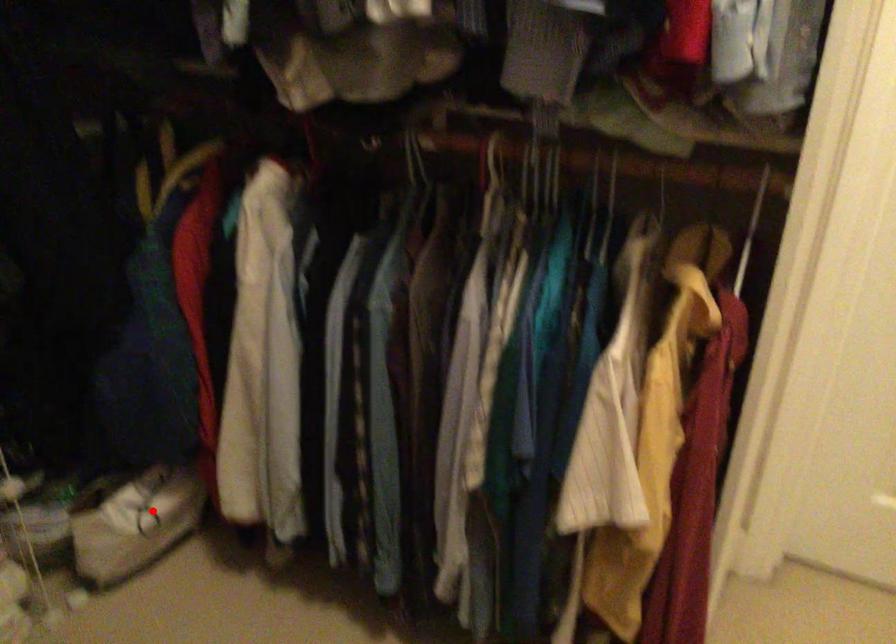
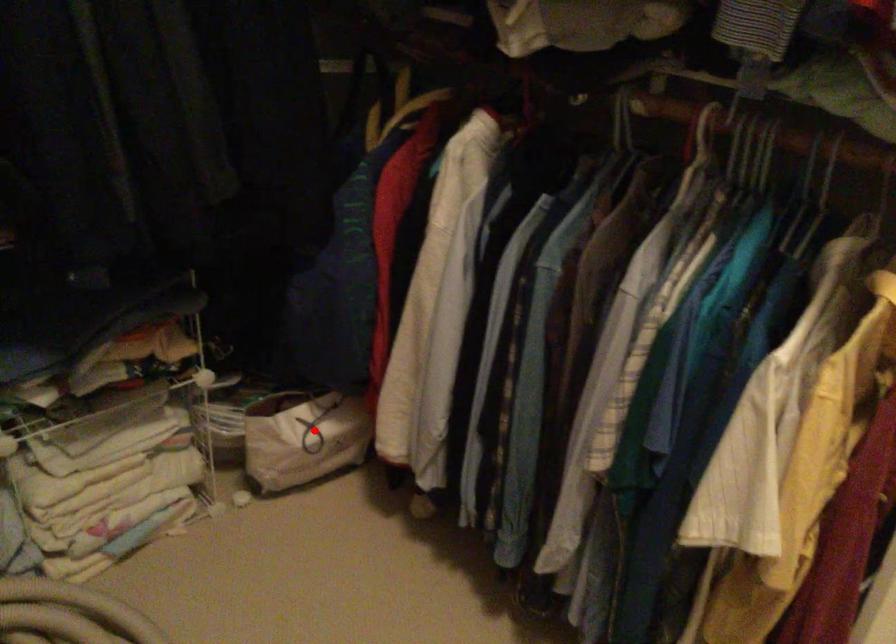
I am providing you with two images of the same scene from different viewpoints. A red point is marked on the first image and another point is marked on the second image. Is the marked point in image1 the same physical position as the marked point in image2?

Yes